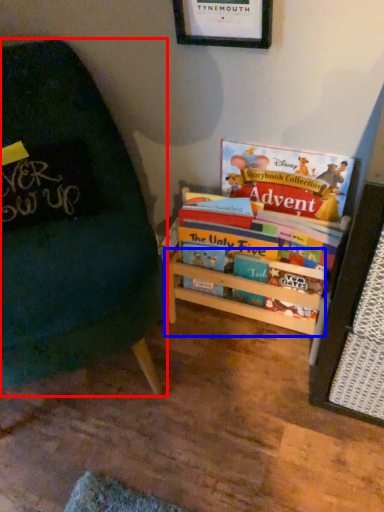
Question: Among these objects, which one is nearest to the camera, chair (highlighted by a red box) or shelf (highlighted by a blue box)?

Choices:
 (A) chair
 (B) shelf

Answer: (A)